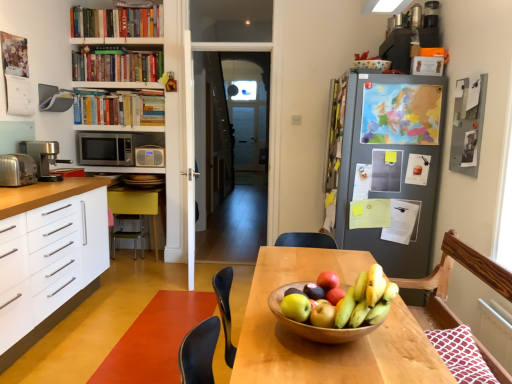
Where is `green matte apple at center, placed as the 3th apple when sorted from back to front`? green matte apple at center, placed as the 3th apple when sorted from back to front is located at coordinates point(296,307).

You are a GUI agent. You are given a task and a screenshot of the screen. Output one action in this format:
    pyautogui.click(x=<x>, y=<y>)
    Task: Click on the green matte apple at center, the 4th apple in the back-to-front sequence
    The height and width of the screenshot is (384, 512).
    Given the screenshot: What is the action you would take?
    pyautogui.click(x=323, y=315)

The width and height of the screenshot is (512, 384). What do you see at coordinates (328, 280) in the screenshot? I see `red matte apple at center, which is the 4th apple from front to back` at bounding box center [328, 280].

In order to face wooden bowl of fruit at center, should I rotate leftwards or rightwards?

It's best to rotate right around 10.090 degrees.

Find the location of a particular element. This screenshot has width=512, height=384. satin silver microwave at left is located at coordinates (105, 149).

Identify the location of green matte apple at center, placed as the 3th apple when sorted from back to front. (296, 307).

From the image's perspective, is silver metallic radio at center, the second appliance viewed from the front, under black plastic chair at center, which is the second chair in back-to-front order?

Incorrect, from the image's perspective, silver metallic radio at center, the second appliance viewed from the front, is higher than black plastic chair at center, which is the second chair in back-to-front order.

How many degrees apart are the facing directions of silver metallic radio at center, the 1th appliance when ordered from back to front, and black plastic chair at center, arranged as the second chair when viewed from the right?

The angular difference between silver metallic radio at center, the 1th appliance when ordered from back to front, and black plastic chair at center, arranged as the second chair when viewed from the right, is 87.6 degrees.

Considering the relative positions of silver metallic radio at center, arranged as the 2th appliance when viewed from the left, and black plastic chair at center, marked as the 2th chair in a front-to-back arrangement, in the image provided, is silver metallic radio at center, arranged as the 2th appliance when viewed from the left, behind black plastic chair at center, marked as the 2th chair in a front-to-back arrangement,?

Yes.

Can you confirm if silver metallic radio at center, acting as the second appliance starting from the bottom, is thinner than black plastic chair at center, arranged as the second chair when viewed from the right?

Yes, silver metallic radio at center, acting as the second appliance starting from the bottom, is thinner than black plastic chair at center, arranged as the second chair when viewed from the right.

Based on the photo, considering the relative positions of green matte apple at center, which is the third apple from front to back, and metallic gray bulletin board at upper right in the image provided, is green matte apple at center, which is the third apple from front to back, to the left or to the right of metallic gray bulletin board at upper right?

green matte apple at center, which is the third apple from front to back, is to the left of metallic gray bulletin board at upper right.

Can you see green matte apple at center, the second apple when ordered from back to front, touching metallic gray bulletin board at upper right?

green matte apple at center, the second apple when ordered from back to front, is not next to metallic gray bulletin board at upper right, and they're not touching.

From a real-world perspective, is green matte apple at center, which is the third apple from front to back, physically located above or below metallic gray bulletin board at upper right?

In terms of real-world spatial position, green matte apple at center, which is the third apple from front to back, is below metallic gray bulletin board at upper right.

From the image's perspective, which apple is the 4th one below the metallic gray bulletin board at upper right? Please provide its 2D coordinates.

[(335, 295)]

Is point (344, 293) farther from viewer compared to point (473, 264)?

No, (344, 293) is closer to viewer.

Would you say green matte apple at center, which is the third apple from front to back, is outside wooden chair at right, arranged as the third chair when viewed from the back?

Yes, green matte apple at center, which is the third apple from front to back, is outside of wooden chair at right, arranged as the third chair when viewed from the back.

From the image's perspective, relative to wooden chair at right, which appears as the 3th chair when viewed from the left, is green matte apple at center, which is the third apple from front to back, above or below?

green matte apple at center, which is the third apple from front to back, is situated higher than wooden chair at right, which appears as the 3th chair when viewed from the left, in the image.

Is green matte apple at center, the second apple when ordered from back to front, smaller than wooden chair at right, which appears as the 3th chair when viewed from the left?

Correct, green matte apple at center, the second apple when ordered from back to front, occupies less space than wooden chair at right, which appears as the 3th chair when viewed from the left.

Is hardcover book at upper left, the third book viewed from the top, at the back of black plastic chair at center, the 2th chair from the left?

black plastic chair at center, the 2th chair from the left, is not turned away from hardcover book at upper left, the third book viewed from the top.

In terms of height, does black plastic chair at center, which is the second chair in back-to-front order, look taller or shorter compared to hardcover book at upper left, which ranks as the 1th book in bottom-to-top order?

In the image, black plastic chair at center, which is the second chair in back-to-front order, appears to be shorter than hardcover book at upper left, which ranks as the 1th book in bottom-to-top order.

Is black plastic chair at center, which is the second chair in back-to-front order, far away from hardcover book at upper left, the third book viewed from the top?

Yes, black plastic chair at center, which is the second chair in back-to-front order, and hardcover book at upper left, the third book viewed from the top, are quite far apart.

In the scene shown: Which of these two, black plastic chair at center, arranged as the second chair when viewed from the right, or wooden chair at right, acting as the 1th chair starting from the front, is smaller?

black plastic chair at center, arranged as the second chair when viewed from the right.

Which object is closer to the camera, black plastic chair at center, the 2th chair from the left, or wooden chair at right, arranged as the third chair when viewed from the back?

Positioned in front is wooden chair at right, arranged as the third chair when viewed from the back.

Which object is wider, black plastic chair at center, which is the second chair in back-to-front order, or wooden chair at right, which appears as the 3th chair when viewed from the left?

With larger width is wooden chair at right, which appears as the 3th chair when viewed from the left.

Is point (229, 339) closer or farther from the camera than point (492, 271)?

Point (229, 339) appears to be farther away from the viewer than point (492, 271).

This screenshot has height=384, width=512. I want to click on the 1st apple to the right when counting from the black plastic chair at center, the 2th chair from the left, so click(296, 307).

Does black plastic chair at center, marked as the 2th chair in a front-to-back arrangement, have a greater height compared to green matte apple at center, placed as the 3th apple when sorted from back to front?

Yes.

Is black plastic chair at center, marked as the 2th chair in a front-to-back arrangement, aimed at green matte apple at center, which is the 2th apple in front-to-back order?

No, black plastic chair at center, marked as the 2th chair in a front-to-back arrangement, is not turned towards green matte apple at center, which is the 2th apple in front-to-back order.

Measure the distance between black plastic chair at center, which is the second chair in back-to-front order, and green matte apple at center, which is the 2th apple in front-to-back order.

black plastic chair at center, which is the second chair in back-to-front order, and green matte apple at center, which is the 2th apple in front-to-back order, are 6.66 feet apart.

The image size is (512, 384). I want to click on chair on the right of green matte apple at center, positioned as the first apple in front-to-back order, so click(x=448, y=282).

Based on the photo, considering the positions of objects wooden chair at right, positioned as the 1th chair in right-to-left order, and green matte apple at center, the 4th apple in the back-to-front sequence, in the image provided, who is more to the right, wooden chair at right, positioned as the 1th chair in right-to-left order, or green matte apple at center, the 4th apple in the back-to-front sequence,?

wooden chair at right, positioned as the 1th chair in right-to-left order, is more to the right.

Is wooden chair at right, acting as the 1th chair starting from the front, far away from green matte apple at center, the 4th apple in the back-to-front sequence?

wooden chair at right, acting as the 1th chair starting from the front, is positioned a significant distance from green matte apple at center, the 4th apple in the back-to-front sequence.

At what (x,y) coordinates should I click in order to perform the action: click on the 1st chair located beneath the silver metallic radio at center, which is the first appliance in right-to-left order (from a real-world perspective). Please return your answer as a coordinate pair (x, y). This screenshot has width=512, height=384. Looking at the image, I should click on (225, 309).

The width and height of the screenshot is (512, 384). In the image, there is a green matte apple at center, which is the third apple from front to back. Find the location of `bulletin board above it (from the image's perspective)`. bulletin board above it (from the image's perspective) is located at coordinates (468, 125).

Based on their spatial positions, is silver metallic radio at center, the second appliance viewed from the front, or hardcover book at upper left, the third book viewed from the top, closer to wooden chair at right, acting as the 1th chair starting from the front?

Based on the image, silver metallic radio at center, the second appliance viewed from the front, appears to be nearer to wooden chair at right, acting as the 1th chair starting from the front.

Looking at this image, considering their positions, is hardcover book at upper left, the third book viewed from the top, positioned closer to green matte apple at center, placed as the 3th apple when sorted from back to front, than red matte apple at center, placed as the 1th apple when sorted from back to front?

red matte apple at center, placed as the 1th apple when sorted from back to front, lies closer to green matte apple at center, placed as the 3th apple when sorted from back to front, than the other object.

Looking at the image, which one is located closer to wooden bowl of fruit at center, wooden table at center or hardcover books at upper center, placed as the first book when sorted from top to bottom?

wooden table at center.

Considering their positions, is red matte apple at center, placed as the 1th apple when sorted from back to front, positioned closer to wooden table at center than green matte apple at center, positioned as the first apple in front-to-back order?

red matte apple at center, placed as the 1th apple when sorted from back to front, lies closer to wooden table at center than the other object.

From the image, which object appears to be nearer to hardcover books at upper center, placed as the first book when sorted from top to bottom, satin silver coffee machine at left or black plastic chair at center, the 2th chair from the left?

Based on the image, satin silver coffee machine at left appears to be nearer to hardcover books at upper center, placed as the first book when sorted from top to bottom.

Consider the image. Considering their positions, is wooden bowl of fruit at center positioned further to green matte apple at center, which is the third apple from front to back, than silver metallic radio at center, the second appliance viewed from the front?

silver metallic radio at center, the second appliance viewed from the front, lies further to green matte apple at center, which is the third apple from front to back, than the other object.

Which object lies further to the anchor point black plastic chair at center, the 2th chair from the left, metallic gray bulletin board at upper right or silver metallic radio at center, the 1th appliance when ordered from back to front?

Among the two, silver metallic radio at center, the 1th appliance when ordered from back to front, is located further to black plastic chair at center, the 2th chair from the left.

Which object lies further to the anchor point green matte apple at center, the 4th apple in the back-to-front sequence, white matte cabinet at left or wooden chair at right, arranged as the third chair when viewed from the back?

white matte cabinet at left lies further to green matte apple at center, the 4th apple in the back-to-front sequence, than the other object.

Locate an element on the screen. bulletin board between wooden table at center and hardcover books at upper center, placed as the first book when sorted from top to bottom, from front to back is located at coordinates (468, 125).

Find the location of a particular element. fruit dish situated between satin silver toaster at left, the 2th appliance in the right-to-left sequence, and green matte apple at center, the second apple when ordered from back to front, from left to right is located at coordinates (336, 309).

Image resolution: width=512 pixels, height=384 pixels. In order to click on coffee machine between satin silver toaster at left, the second appliance viewed from the top, and red matte apple at center, placed as the 1th apple when sorted from back to front in this screenshot , I will do `click(42, 158)`.

Image resolution: width=512 pixels, height=384 pixels. Identify the location of chair positioned between green matte apple at center, positioned as the first apple in front-to-back order, and metallic yellow chair at center, the 3th chair from the right, from near to far. (225, 309).